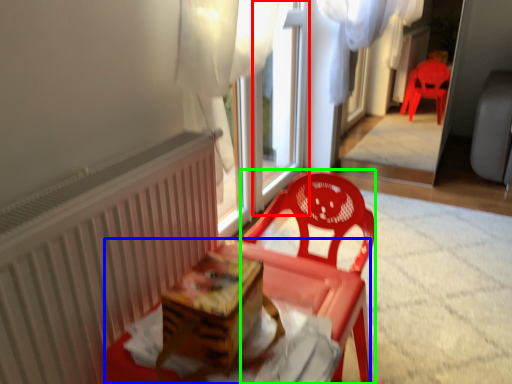
Question: Which is farther away from window frame (highlighted by a red box)? table (highlighted by a blue box) or chair (highlighted by a green box)?

Choices:
 (A) table
 (B) chair

Answer: (A)